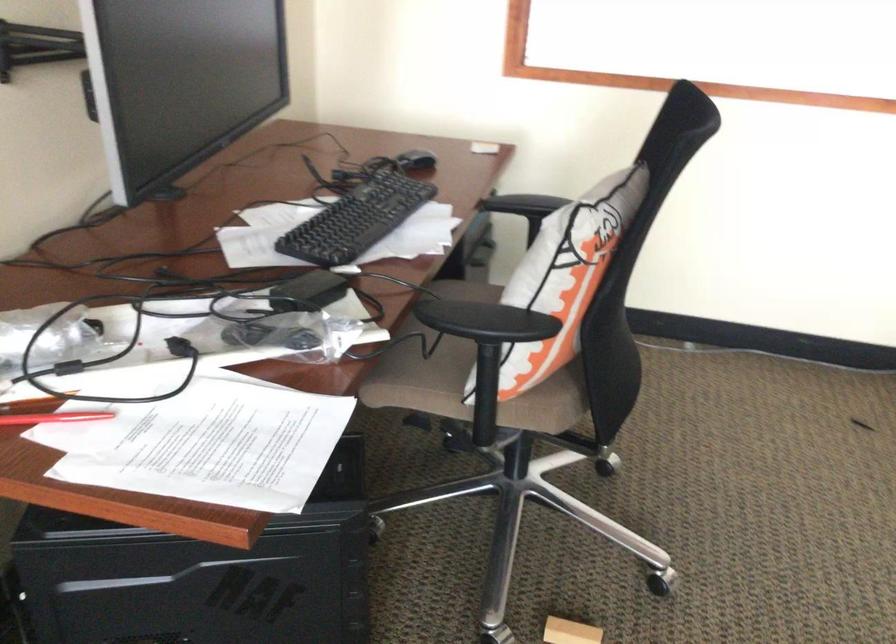
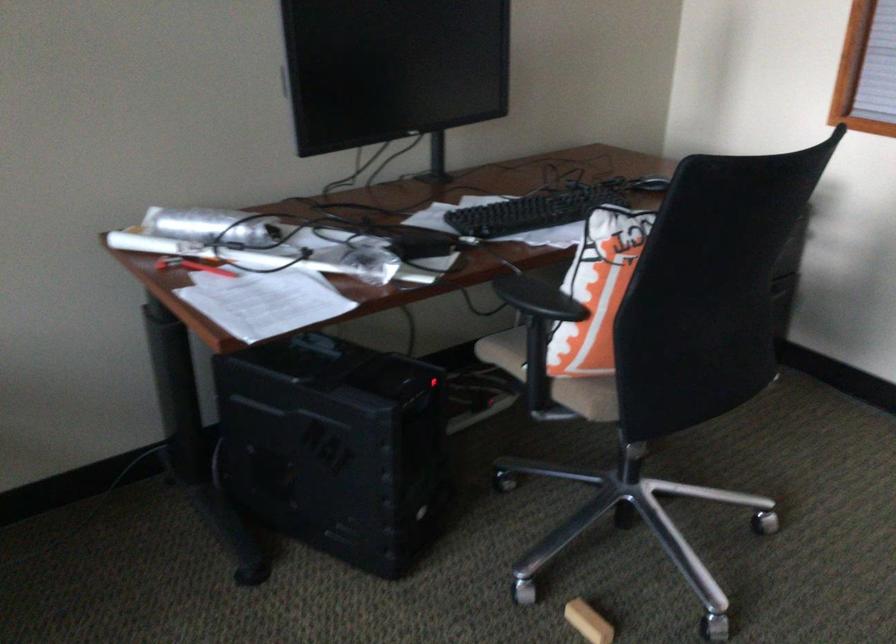
Find the pixel in the second image that matches [503,402] in the first image.

(552, 377)